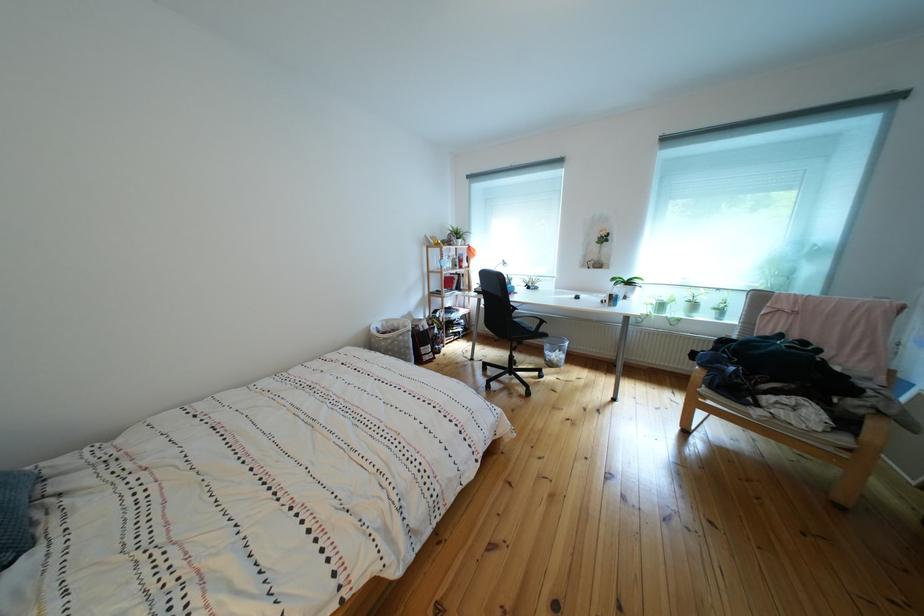
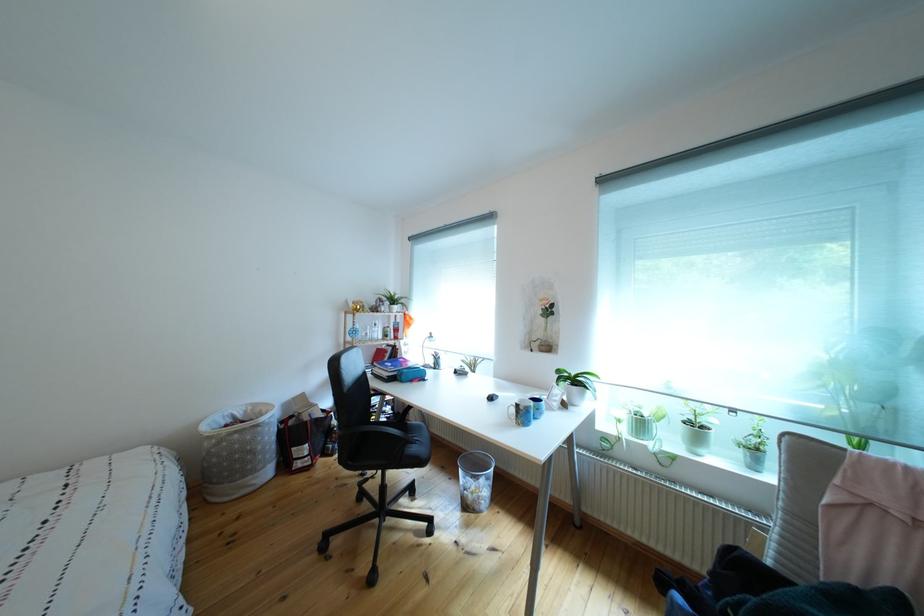
The point at (x=419, y=353) is marked in the first image. Where is the corresponding point in the second image?

(263, 456)